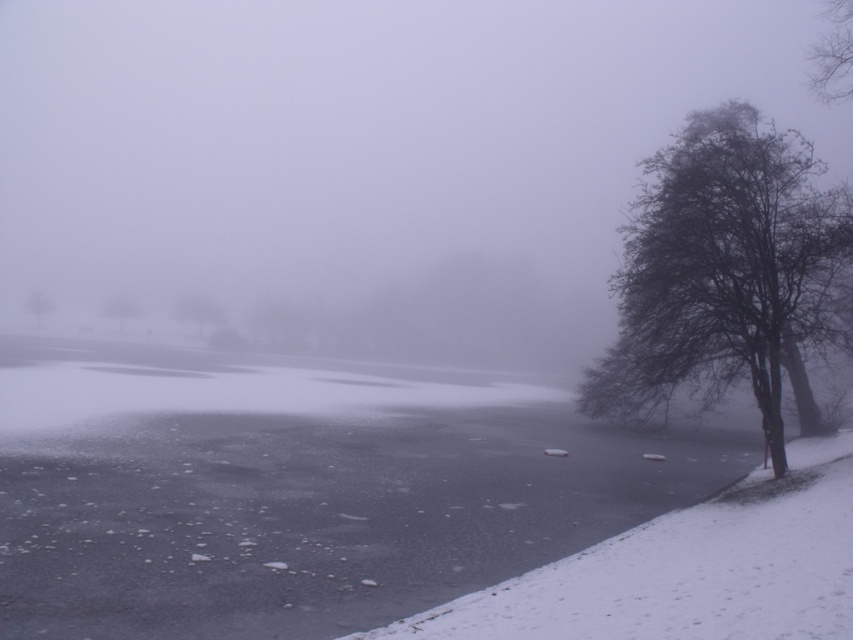
Who is taller, bare branches at upper right or green matte tree at center?

bare branches at upper right is taller.

What do you see at coordinates (833, 54) in the screenshot?
I see `bare branches at upper right` at bounding box center [833, 54].

Is point (843, 52) positioned after point (196, 332)?

No, it is not.

Find the location of `bare branches at upper right`. bare branches at upper right is located at coordinates (833, 54).

Can you confirm if brown matte tree at center is positioned above smooth gray tree at center?

Yes.

Between brown matte tree at center and smooth gray tree at center, which one has less height?

With less height is smooth gray tree at center.

What do you see at coordinates (120, 310) in the screenshot? Image resolution: width=853 pixels, height=640 pixels. I see `brown matte tree at center` at bounding box center [120, 310].

Where is `brown matte tree at center`? Image resolution: width=853 pixels, height=640 pixels. brown matte tree at center is located at coordinates (120, 310).

Is dark gray bark tree at right taller than bare branches at left?

Yes, dark gray bark tree at right is taller than bare branches at left.

Is dark gray bark tree at right closer to the viewer compared to bare branches at left?

That is True.

Where is `dark gray bark tree at right`? Image resolution: width=853 pixels, height=640 pixels. dark gray bark tree at right is located at coordinates (721, 269).